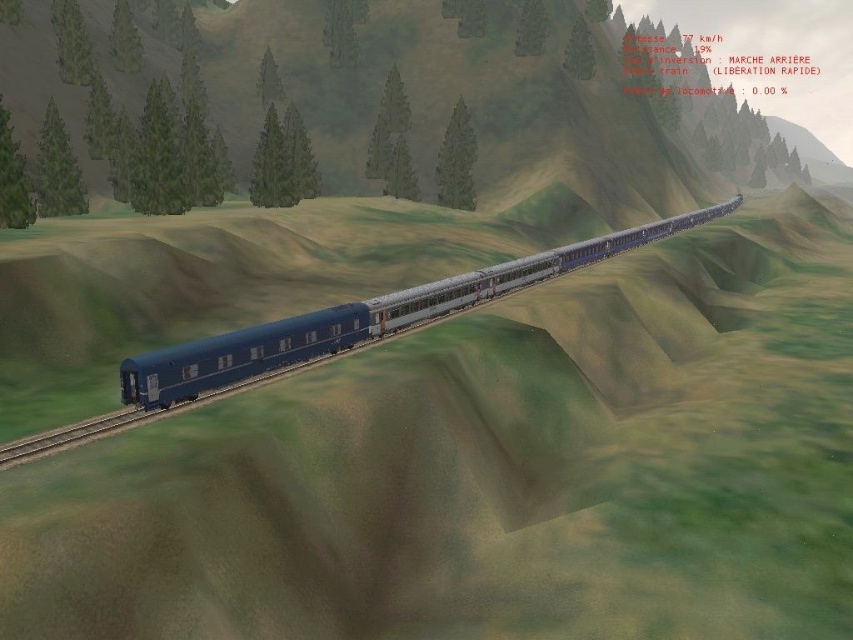
Consider the image. Which is above, metallic blue train at center or gray metallic train track at lower left?

metallic blue train at center is higher up.

Can you confirm if metallic blue train at center is wider than gray metallic train track at lower left?

Yes.

Identify the location of metallic blue train at center. (361, 317).

You are a GUI agent. You are given a task and a screenshot of the screen. Output one action in this format:
    pyautogui.click(x=<x>, y=<y>)
    Task: Click on the metallic blue train at center
    The height and width of the screenshot is (640, 853).
    Given the screenshot: What is the action you would take?
    pyautogui.click(x=361, y=317)